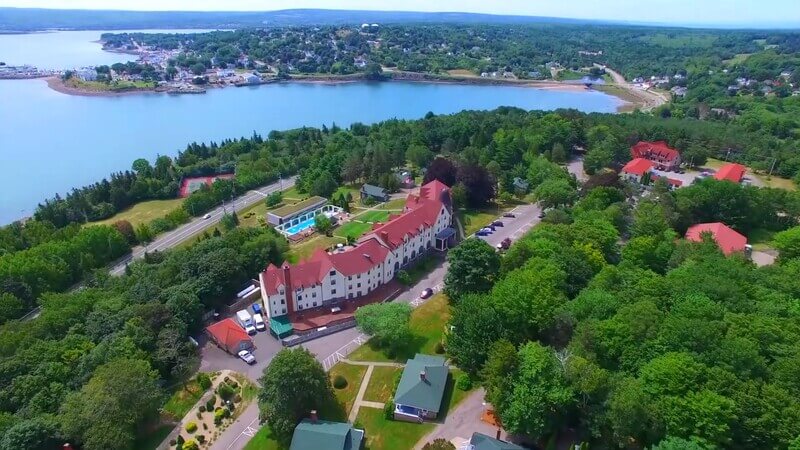
Locate an element on the screen. chimney is located at coordinates (314, 417).